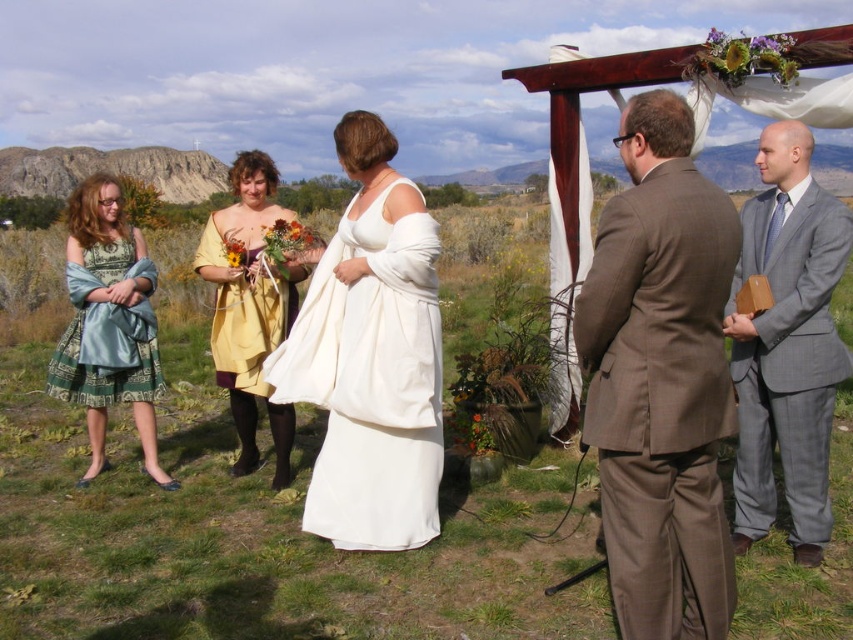
You are a photographer at the wedding ceremony. You need to capture a photo where the white satin dress at center and the green satin dress at left are both visible. Which dress will have its hemline visible lower in the photo?

The green satin dress at left has a longer hemline, so its hemline will be visible lower in the photo than the white satin dress at center.

You are standing at the point marked as point (93, 257) and want to see the point marked as point (228, 356). Can you see it without moving your position?

Point (228, 356) is behind point (93, 257), so you cannot see it from your current position without moving.